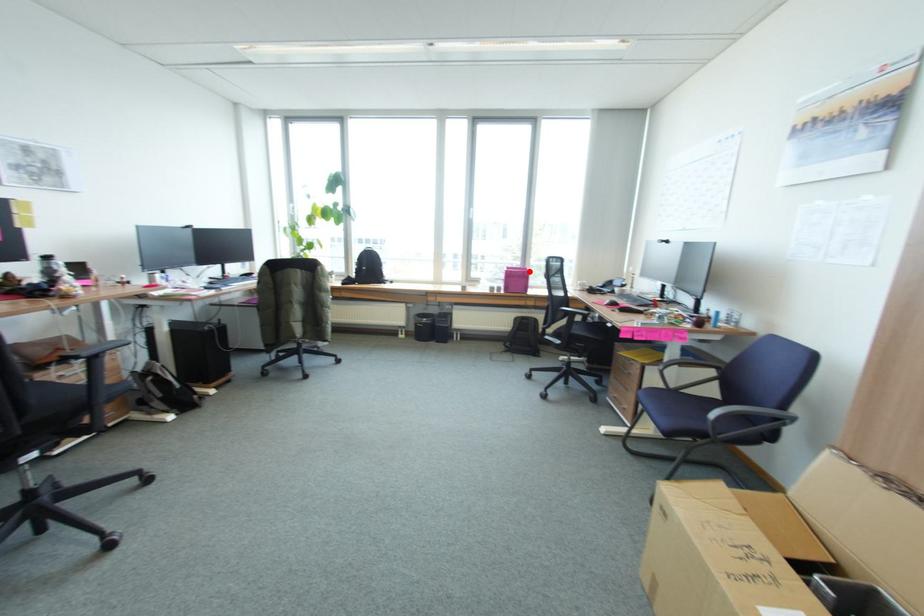
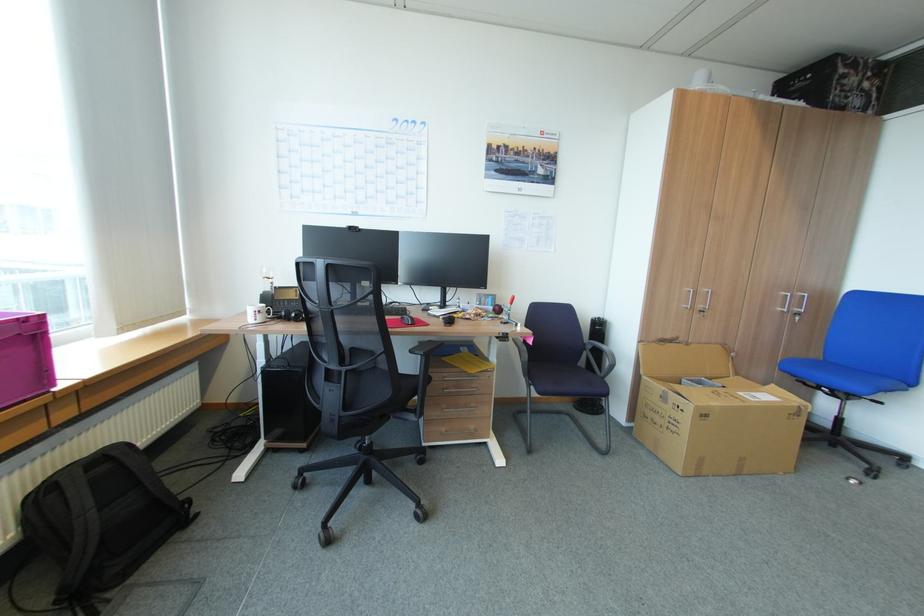
Where in the second image is the point corresponding to the highlighted location from the first image?

(29, 321)